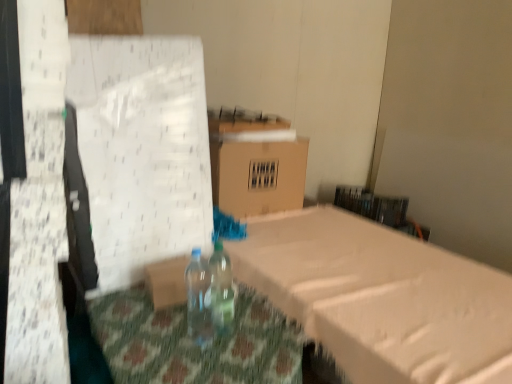
Question: Does brown cardboard box at center lie in front of transparent plastic bottle at center, the first bottle when ordered from right to left?

Choices:
 (A) yes
 (B) no

Answer: (B)

Question: Is brown cardboard box at center thinner than transparent plastic bottle at center, the first bottle when ordered from right to left?

Choices:
 (A) yes
 (B) no

Answer: (B)

Question: From the image's perspective, is brown cardboard box at center on transparent plastic bottle at center, the 2th bottle when ordered from left to right?

Choices:
 (A) no
 (B) yes

Answer: (B)

Question: Is brown cardboard box at center placed right next to transparent plastic bottle at center, the 2th bottle when ordered from left to right?

Choices:
 (A) no
 (B) yes

Answer: (A)

Question: Does brown cardboard box at center have a larger size compared to transparent plastic bottle at center, the first bottle when ordered from right to left?

Choices:
 (A) no
 (B) yes

Answer: (B)

Question: Is brown cardboard box at center wider or thinner than translucent plastic bottle at center, which is the second bottle in right-to-left order?

Choices:
 (A) wide
 (B) thin

Answer: (A)

Question: Based on their sizes in the image, would you say brown cardboard box at center is bigger or smaller than translucent plastic bottle at center, the 1th bottle from the left?

Choices:
 (A) small
 (B) big

Answer: (B)

Question: From a real-world perspective, is brown cardboard box at center physically located above or below translucent plastic bottle at center, which is the second bottle in right-to-left order?

Choices:
 (A) below
 (B) above

Answer: (B)

Question: Is brown cardboard box at center inside the boundaries of translucent plastic bottle at center, which is the second bottle in right-to-left order, or outside?

Choices:
 (A) outside
 (B) inside

Answer: (A)

Question: Is transparent plastic bottle at center, the 2th bottle when ordered from left to right, to the left or to the right of brown cardboard box at center in the image?

Choices:
 (A) right
 (B) left

Answer: (B)

Question: Is transparent plastic bottle at center, the 2th bottle when ordered from left to right, spatially inside brown cardboard box at center, or outside of it?

Choices:
 (A) outside
 (B) inside

Answer: (A)

Question: In terms of size, does transparent plastic bottle at center, the first bottle when ordered from right to left, appear bigger or smaller than brown cardboard box at center?

Choices:
 (A) small
 (B) big

Answer: (A)

Question: Considering their positions, is transparent plastic bottle at center, the 2th bottle when ordered from left to right, located in front of or behind brown cardboard box at center?

Choices:
 (A) behind
 (B) front

Answer: (B)

Question: Does point (232, 322) appear closer or farther from the camera than point (196, 253)?

Choices:
 (A) closer
 (B) farther

Answer: (B)

Question: Is transparent plastic bottle at center, the first bottle when ordered from right to left, to the left or to the right of translucent plastic bottle at center, which is the second bottle in right-to-left order, in the image?

Choices:
 (A) left
 (B) right

Answer: (B)